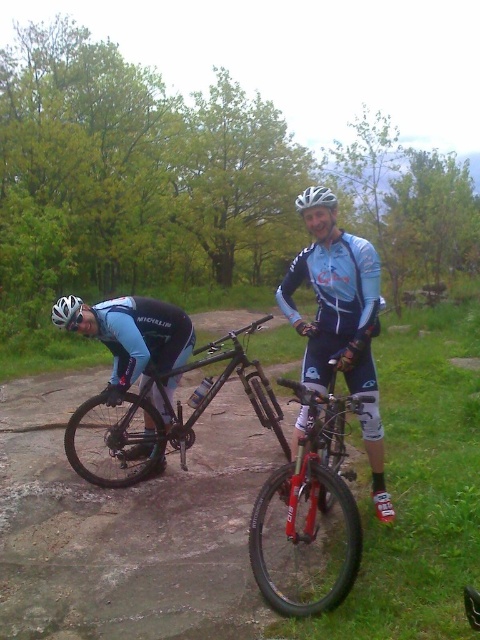
Question: Is white matte helmet at center to the left of white matte bicycle helmet at upper center from the viewer's perspective?

Choices:
 (A) yes
 (B) no

Answer: (A)

Question: Which of these objects is positioned farthest from the matte black mountain bike at left?

Choices:
 (A) white matte bicycle helmet at left
 (B) white matte bicycle helmet at upper center
 (C) shiny red bike at center
 (D) light blue jersey at center

Answer: (B)

Question: Observing the image, what is the correct spatial positioning of light blue jersey at center in reference to white matte helmet at center?

Choices:
 (A) above
 (B) below

Answer: (B)

Question: Does shiny red bike at center appear under white matte bicycle helmet at left?

Choices:
 (A) yes
 (B) no

Answer: (A)

Question: Which point is closer to the camera?

Choices:
 (A) (50, 317)
 (B) (295, 604)
 (C) (309, 211)

Answer: (B)

Question: Which object is positioned farthest from the white matte bicycle helmet at left?

Choices:
 (A) white matte bicycle helmet at upper center
 (B) light blue jersey at center
 (C) shiny red bike at center
 (D) white matte helmet at center

Answer: (A)